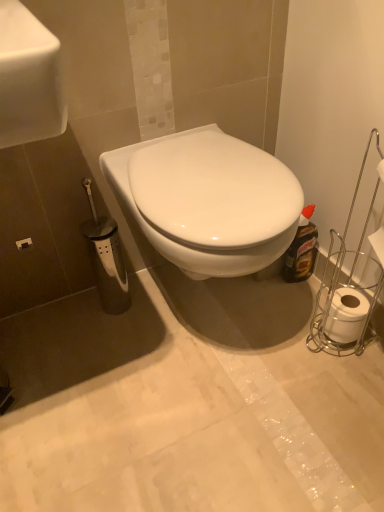
This screenshot has height=512, width=384. I want to click on white matte toilet paper at right, so click(346, 315).

What do you see at coordinates (346, 315) in the screenshot?
I see `white matte toilet paper at right` at bounding box center [346, 315].

At what (x,y) coordinates should I click in order to perform the action: click on white matte toilet paper at right. Please return your answer as a coordinate pair (x, y). Image resolution: width=384 pixels, height=512 pixels. Looking at the image, I should click on (346, 315).